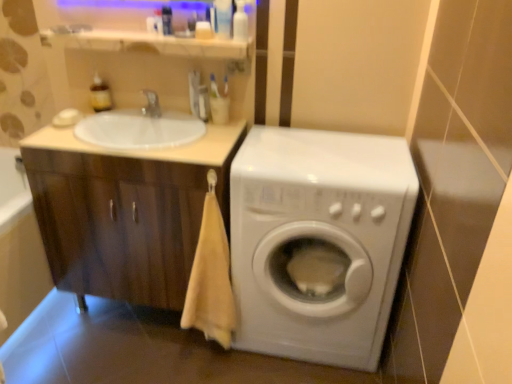
The image size is (512, 384). Find the location of `unoccupied region to the right of white glossy tap at upper center`. unoccupied region to the right of white glossy tap at upper center is located at coordinates (178, 121).